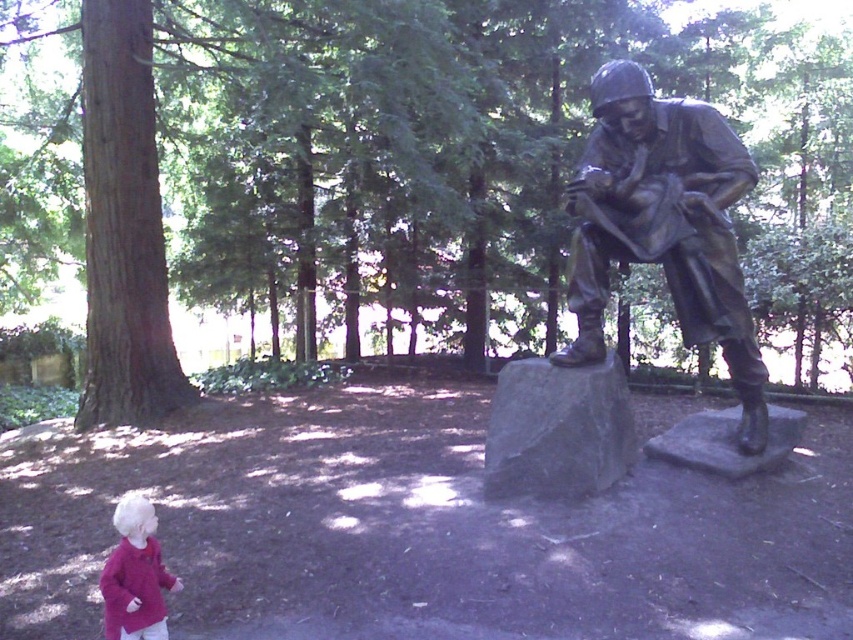
Between bronze statue at right and matte pink sweater at lower left, which one is positioned lower?

Positioned lower is matte pink sweater at lower left.

Which is behind, point (691, 340) or point (148, 618)?

Positioned behind is point (691, 340).

Identify the location of bronze statue at right. (664, 225).

Is bronze statue at right above gray stone at center?

Correct, bronze statue at right is located above gray stone at center.

Can you confirm if bronze statue at right is shorter than gray stone at center?

In fact, bronze statue at right may be taller than gray stone at center.

Is point (717, 230) behind point (618, 410)?

No, (717, 230) is closer to viewer.

Where is `bronze statue at right`? The image size is (853, 640). bronze statue at right is located at coordinates (664, 225).

Which is more to the left, gray stone at center or matte pink sweater at lower left?

From the viewer's perspective, matte pink sweater at lower left appears more on the left side.

Which is behind, point (523, 419) or point (108, 573)?

The point (523, 419) is more distant.

At what (x,y) coordinates should I click in order to perform the action: click on gray stone at center. Please return your answer as a coordinate pair (x, y). The width and height of the screenshot is (853, 640). Looking at the image, I should click on (556, 429).